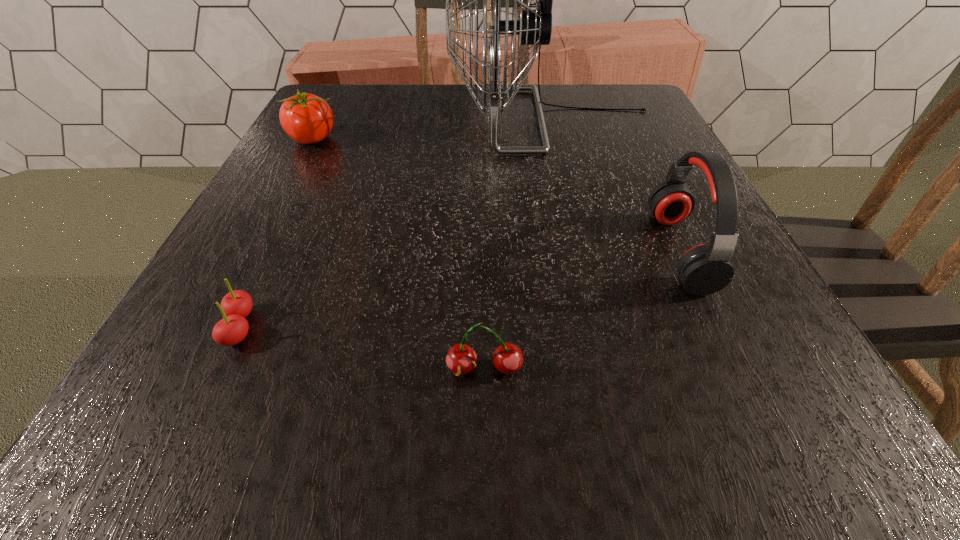
Where is `cherry situated at the left edge`? The image size is (960, 540). cherry situated at the left edge is located at coordinates (236, 305).

The width and height of the screenshot is (960, 540). I want to click on fan that is at the right edge, so click(x=534, y=27).

At what (x,y) coordinates should I click in order to perform the action: click on earphone that is positioned at the right edge. Please return your answer as a coordinate pair (x, y). Looking at the image, I should click on (x=705, y=269).

What are the coordinates of `object present at the far left corner` in the screenshot? It's located at (306, 118).

Identify the location of object at the far right corner. Image resolution: width=960 pixels, height=540 pixels. (534, 27).

I want to click on vacant area at the far edge of the desktop, so click(394, 118).

Locate an element on the screen. The width and height of the screenshot is (960, 540). blank area at the near edge is located at coordinates (504, 453).

Identify the location of free space at the left edge of the desktop. This screenshot has width=960, height=540. (269, 280).

The width and height of the screenshot is (960, 540). I want to click on vacant space at the right edge of the desktop, so click(660, 145).

Locate an element on the screen. Image resolution: width=960 pixels, height=540 pixels. vacant space at the far right corner of the desktop is located at coordinates (651, 110).